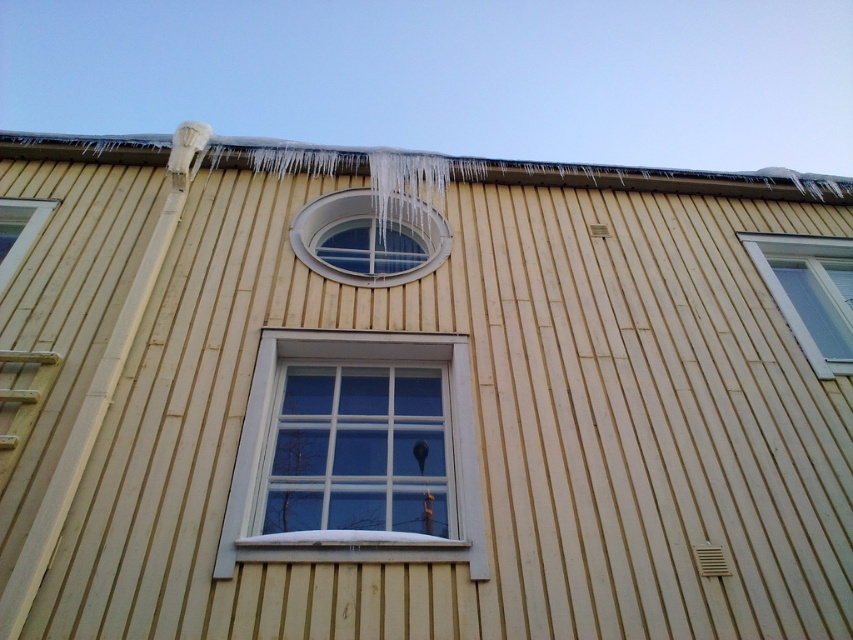
Which is more to the right, white painted wood window frame at center or white plastic window at upper right?

white plastic window at upper right

How distant is white painted wood window frame at center from white plastic window at upper right?

white painted wood window frame at center is 11.53 feet from white plastic window at upper right.

Find the location of a particular element. The height and width of the screenshot is (640, 853). white painted wood window frame at center is located at coordinates (354, 538).

Who is more distant from viewer, [795,172] or [254,372]?

The point [795,172] is more distant.

Does icicle ice at upper appear on the left side of white painted wood window frame at center?

Indeed, icicle ice at upper is positioned on the left side of white painted wood window frame at center.

Locate an element on the screen. Image resolution: width=853 pixels, height=640 pixels. icicle ice at upper is located at coordinates [647, 179].

Does white painted wood window frame at center have a smaller size compared to clear glass window at upper left?

No, white painted wood window frame at center is not smaller than clear glass window at upper left.

Between white painted wood window frame at center and clear glass window at upper left, which one is positioned lower?

white painted wood window frame at center is lower down.

Which is behind, point (364, 541) or point (4, 225)?

Point (4, 225)

Identify the location of white painted wood window frame at center. (354, 538).